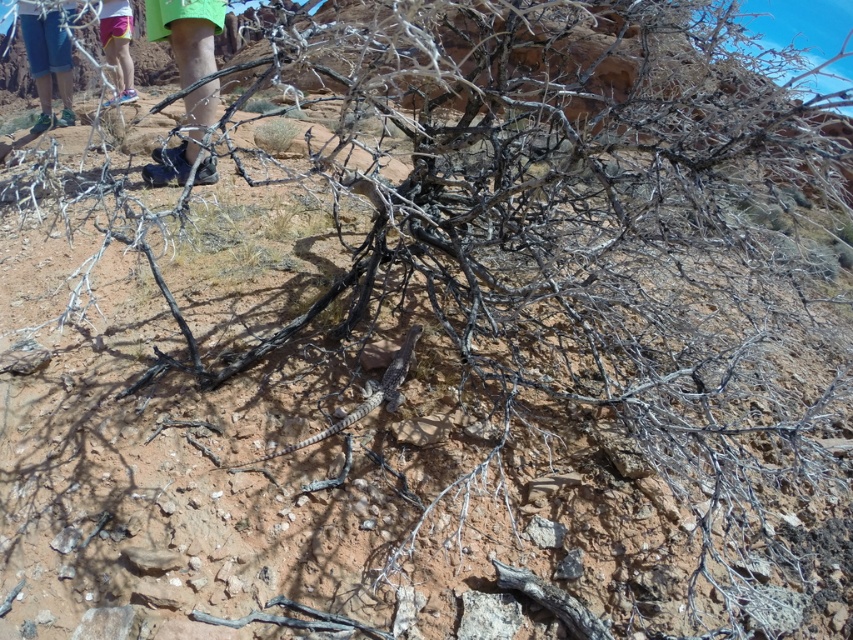
Question: Which of these objects is positioned closest to the blue denim shorts at upper left?

Choices:
 (A) black leather shoe at upper left
 (B) pink fabric shorts at upper left

Answer: (B)

Question: Based on their relative distances, which object is nearer to the blue denim shorts at upper left?

Choices:
 (A) pink fabric shorts at upper left
 (B) black leather shoe at upper left

Answer: (A)

Question: Can you confirm if black leather shoe at upper left is positioned below pink fabric shorts at upper left?

Choices:
 (A) no
 (B) yes

Answer: (B)

Question: Among these objects, which one is farthest from the camera?

Choices:
 (A) black leather shoe at upper left
 (B) blue denim shorts at upper left
 (C) pink fabric shorts at upper left

Answer: (C)

Question: Observing the image, what is the correct spatial positioning of blue denim shorts at upper left in reference to pink fabric shorts at upper left?

Choices:
 (A) right
 (B) left

Answer: (B)

Question: Is black leather shoe at upper left closer to the viewer compared to pink fabric shorts at upper left?

Choices:
 (A) yes
 (B) no

Answer: (A)